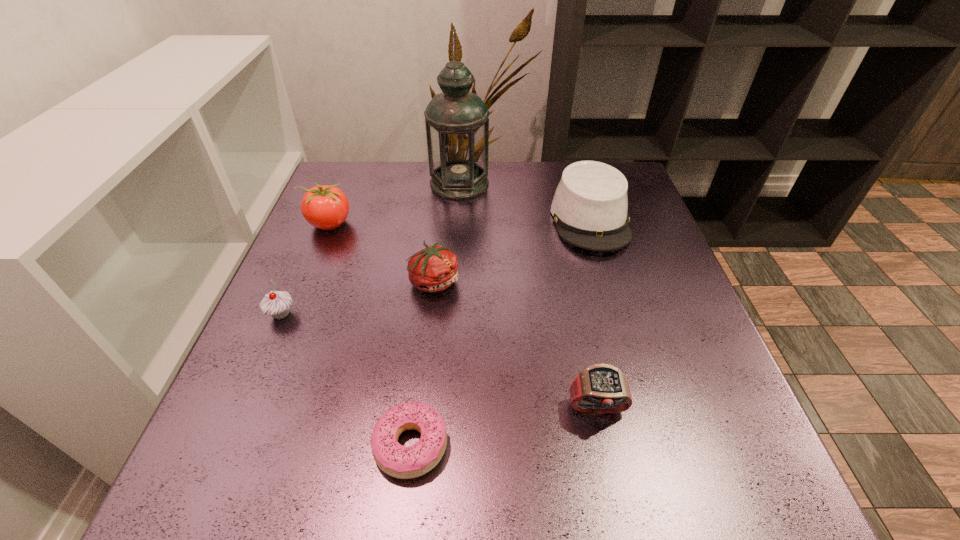
The height and width of the screenshot is (540, 960). I want to click on vacant space located on the front of the taller tomato, so click(x=276, y=355).

This screenshot has width=960, height=540. I want to click on vacant space located on the front-facing side of the hat, so click(614, 302).

Locate an element on the screen. This screenshot has height=540, width=960. vacant space located 0.270m on the front of the cupcake is located at coordinates (217, 464).

You are a GUI agent. You are given a task and a screenshot of the screen. Output one action in this format:
    pyautogui.click(x=<x>, y=<y>)
    Task: Click on the vacant space located 0.110m on the right of the fourth farthest object
    The image size is (960, 540).
    Given the screenshot: What is the action you would take?
    pyautogui.click(x=512, y=281)

Image resolution: width=960 pixels, height=540 pixels. Find the location of `vacant point located on the right of the watch`. vacant point located on the right of the watch is located at coordinates (723, 409).

The width and height of the screenshot is (960, 540). I want to click on free location located on the back of the shortest object, so click(x=421, y=353).

At what (x,y) coordinates should I click in order to perform the action: click on oil lamp at the far edge. Please return your answer as a coordinate pair (x, y). The height and width of the screenshot is (540, 960). Looking at the image, I should click on (457, 125).

This screenshot has width=960, height=540. I want to click on hat present at the far edge, so click(x=590, y=205).

Identify the location of object that is at the near edge. (396, 460).

Find the location of `tomato located in the left edge section of the desktop`. tomato located in the left edge section of the desktop is located at coordinates (326, 207).